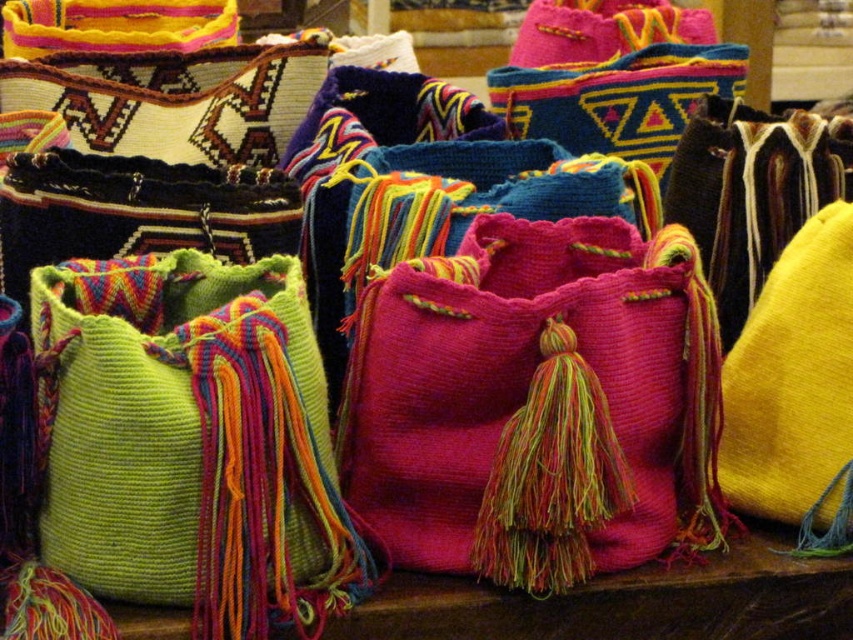
Question: Does fuzzy pink bag at center have a greater width compared to yellow fabric pillow at right?

Choices:
 (A) yes
 (B) no

Answer: (A)

Question: Which point is farther from the camera taking this photo?

Choices:
 (A) (763, 440)
 (B) (447, 378)

Answer: (A)

Question: Is fuzzy pink bag at center above yellow fabric pillow at right?

Choices:
 (A) yes
 (B) no

Answer: (B)

Question: Is fuzzy pink bag at center wider than yellow fabric pillow at right?

Choices:
 (A) yes
 (B) no

Answer: (A)